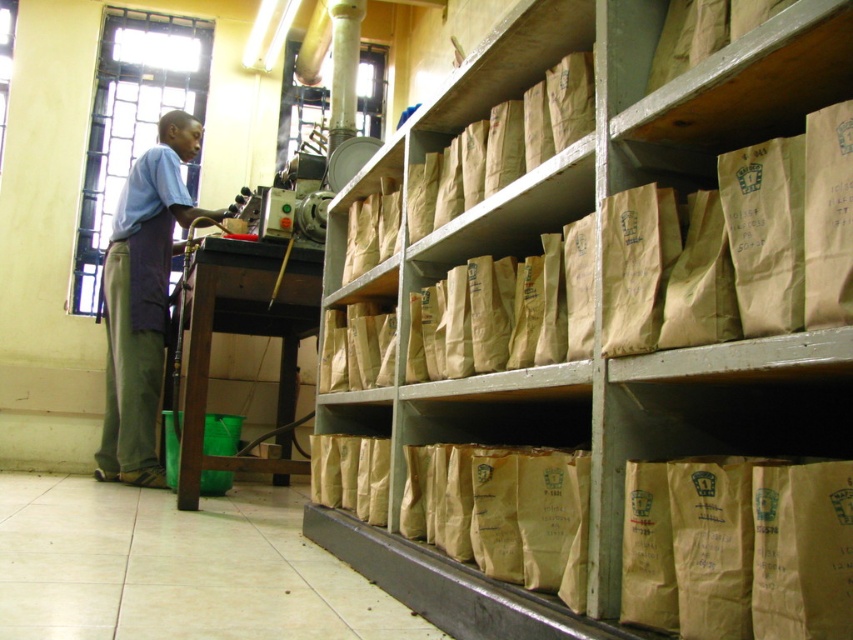
Question: Which point appears farthest from the camera in this image?

Choices:
 (A) (161, 252)
 (B) (474, 433)

Answer: (A)

Question: Which object appears farthest from the camera in this image?

Choices:
 (A) blue fabric apron at left
 (B) brown paper bags at right

Answer: (A)

Question: Where is brown paper bags at right located in relation to blue fabric apron at left in the image?

Choices:
 (A) left
 (B) right

Answer: (B)

Question: Considering the relative positions of brown paper bags at right and blue fabric apron at left in the image provided, where is brown paper bags at right located with respect to blue fabric apron at left?

Choices:
 (A) above
 (B) below

Answer: (B)

Question: Can you confirm if brown paper bags at right is positioned below blue fabric apron at left?

Choices:
 (A) no
 (B) yes

Answer: (B)